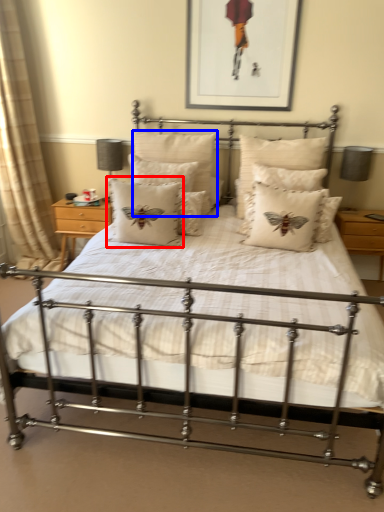
Question: Which object is closer to the camera taking this photo, pillow (highlighted by a red box) or pillow (highlighted by a blue box)?

Choices:
 (A) pillow
 (B) pillow

Answer: (A)